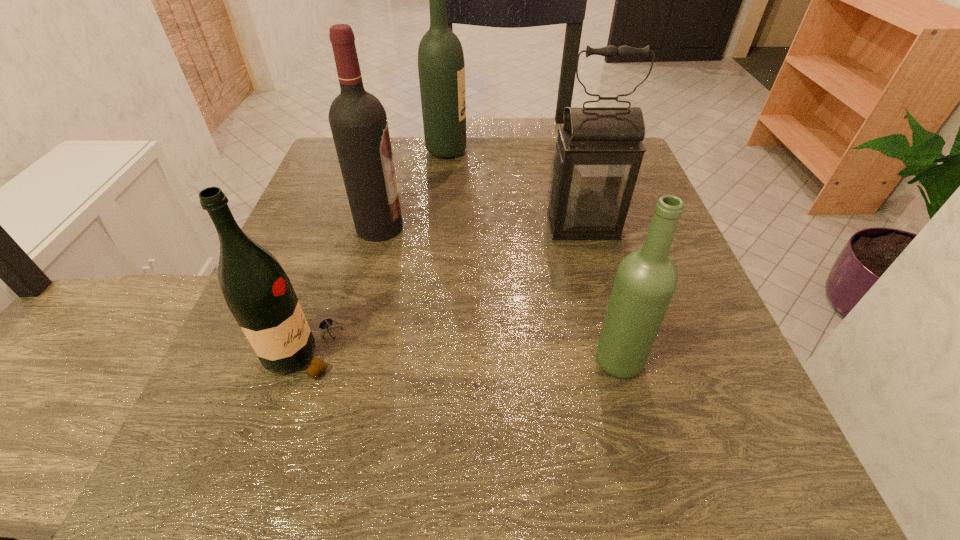
Where is `the third wine bottle from left to right`? the third wine bottle from left to right is located at coordinates (441, 67).

At what (x,y) coordinates should I click in order to perform the action: click on the farthest object. Please return your answer as a coordinate pair (x, y). Looking at the image, I should click on (441, 67).

Locate an element on the screen. the second farthest wine bottle is located at coordinates [x=358, y=121].

I want to click on lantern, so click(x=599, y=150).

The width and height of the screenshot is (960, 540). I want to click on the rightmost wine bottle, so click(646, 279).

Locate an element on the screen. This screenshot has height=540, width=960. vacant space situated on the labeled side of the farthest wine bottle is located at coordinates (551, 151).

The height and width of the screenshot is (540, 960). Find the location of `vacant area located 0.260m on the label of the third nearest wine bottle`. vacant area located 0.260m on the label of the third nearest wine bottle is located at coordinates coord(532,227).

You are a GUI agent. You are given a task and a screenshot of the screen. Output one action in this format:
    pyautogui.click(x=<x>, y=<y>)
    Task: Click on the free location located on the front-facing side of the lantern
    
    Given the screenshot: What is the action you would take?
    pyautogui.click(x=594, y=269)

Identify the location of vacant space located 0.100m on the front of the rightmost wine bottle. The height and width of the screenshot is (540, 960). (641, 449).

Find the location of a particular element. The height and width of the screenshot is (540, 960). object positioned at the far edge is located at coordinates (441, 67).